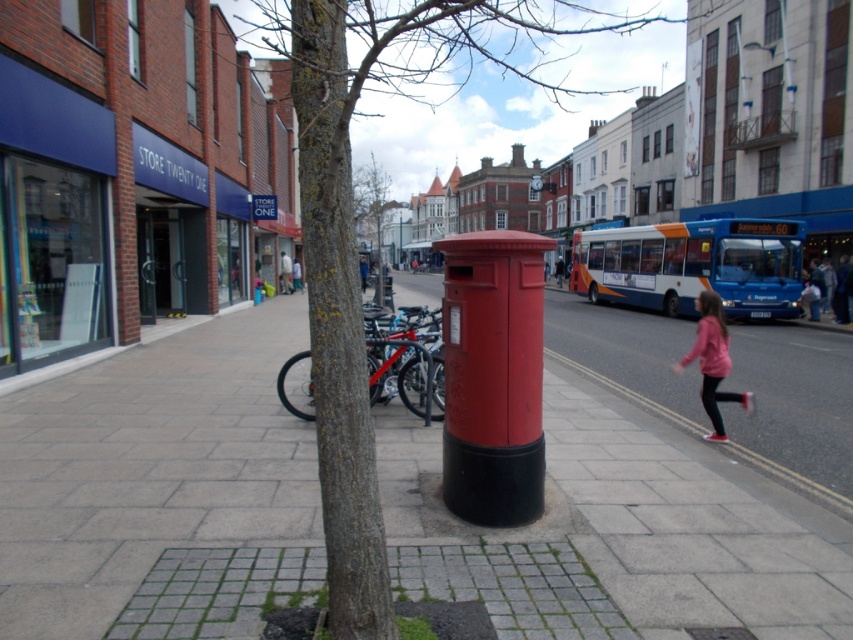
Between smooth concrete pavement at center and green rough bark tree at upper center, which one is positioned higher?

green rough bark tree at upper center

Does smooth concrete pavement at center have a greater height compared to green rough bark tree at upper center?

No.

Which is in front, point (563, 454) or point (383, 282)?

Positioned in front is point (563, 454).

Locate an element on the screen. The image size is (853, 640). smooth concrete pavement at center is located at coordinates (152, 474).

Does point (355, 196) come closer to viewer compared to point (289, 269)?

No, (355, 196) is further to viewer.

Is green rough bark tree at upper center taller than white cotton jacket at center?

Yes, green rough bark tree at upper center is taller than white cotton jacket at center.

Is point (363, 193) closer to viewer compared to point (277, 260)?

No, it is behind (277, 260).

The height and width of the screenshot is (640, 853). I want to click on green rough bark tree at upper center, so click(x=374, y=220).

In the scene shown: Between blue metallic bus at center and pink fabric girl at lower right, which one is positioned higher?

Positioned higher is blue metallic bus at center.

The image size is (853, 640). What are the coordinates of `blue metallic bus at center` in the screenshot? It's located at (693, 266).

What do you see at coordinates (693, 266) in the screenshot? The height and width of the screenshot is (640, 853). I see `blue metallic bus at center` at bounding box center [693, 266].

Locate an element on the screen. blue metallic bus at center is located at coordinates (693, 266).